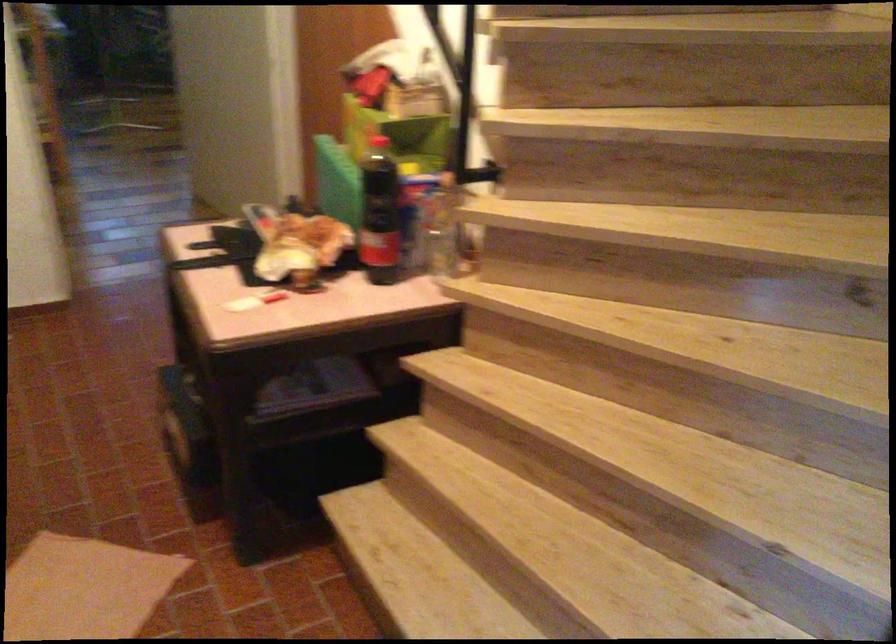
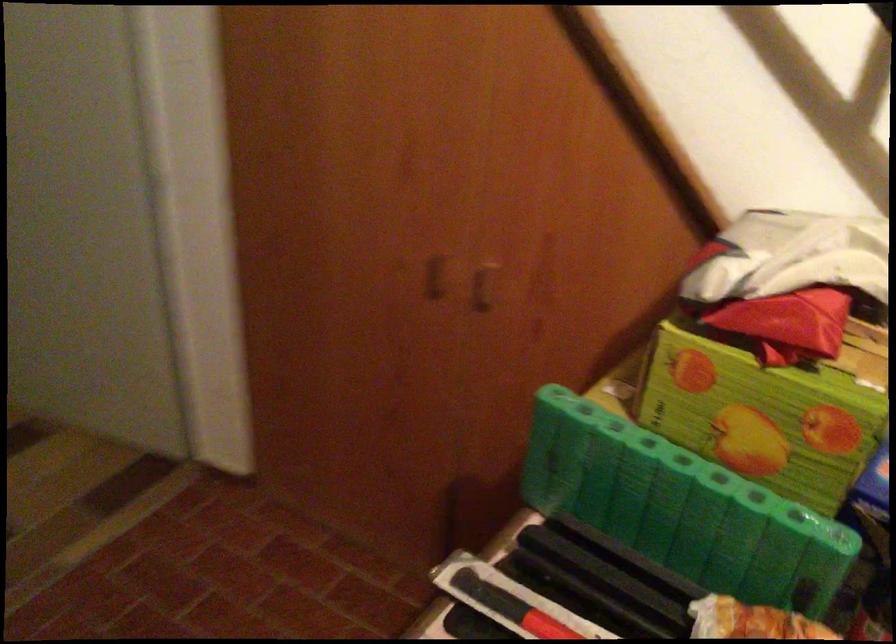
In a continuous first-person perspective shot, in which direction is the camera moving?

The cameraman walked toward left, forward.